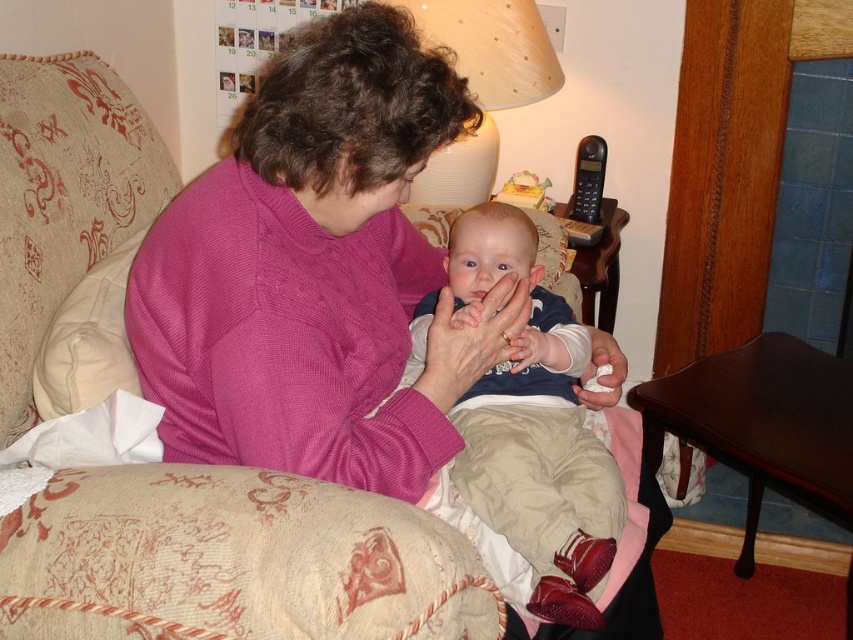
Does smooth beige pants at center have a greater width compared to beige fabric lampshade at upper center?

No, smooth beige pants at center is not wider than beige fabric lampshade at upper center.

Can you confirm if smooth beige pants at center is positioned to the right of beige fabric lampshade at upper center?

Yes, smooth beige pants at center is to the right of beige fabric lampshade at upper center.

Is point (519, 348) positioned behind point (438, 186)?

No, it is not.

Find the location of `smooth beige pants at center`. smooth beige pants at center is located at coordinates (532, 426).

Which of these two, pink knitted sweater at center or beige fabric lampshade at upper center, stands taller?

pink knitted sweater at center is taller.

Who is higher up, pink knitted sweater at center or beige fabric lampshade at upper center?

beige fabric lampshade at upper center is above.

Who is more forward, (236, 179) or (521, 77)?

Point (236, 179) is in front.

The width and height of the screenshot is (853, 640). Identify the location of pink knitted sweater at center. (316, 272).

Who is more distant from viewer, (419,490) or (572,579)?

The point (572,579) is behind.

Does pink knitted sweater at center have a greater height compared to smooth beige pants at center?

Yes, pink knitted sweater at center is taller than smooth beige pants at center.

Locate an element on the screen. pink knitted sweater at center is located at coordinates (316, 272).